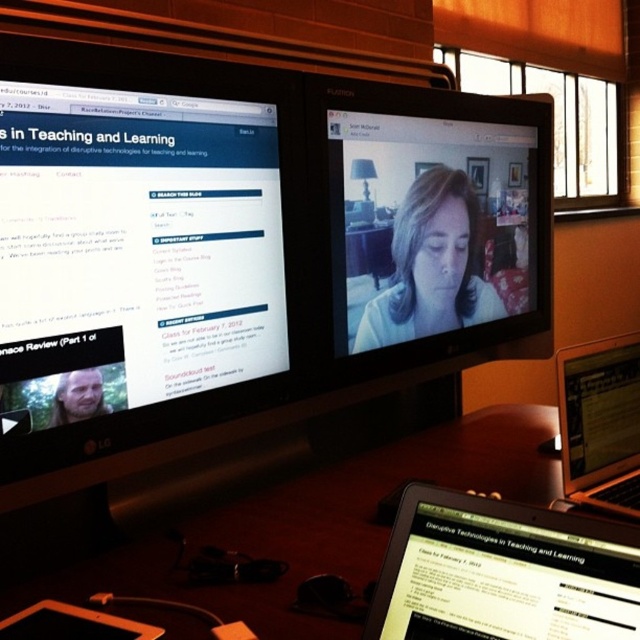
Does wooden desk at center appear on the right side of matte black tablet at lower right?

No, wooden desk at center is not to the right of matte black tablet at lower right.

Identify the location of wooden desk at center. (320, 522).

I want to click on wooden desk at center, so click(x=320, y=522).

Locate an element on the screen. The width and height of the screenshot is (640, 640). wooden desk at center is located at coordinates (320, 522).

In the scene shown: Can you confirm if matte black tablet at lower right is shorter than matte white face at center?

Yes, matte black tablet at lower right is shorter than matte white face at center.

Does point (630, 536) come farther from viewer compared to point (442, 204)?

No, (630, 536) is in front of (442, 204).

Where is `matte black tablet at lower right`? This screenshot has height=640, width=640. matte black tablet at lower right is located at coordinates (502, 572).

Does black glossy monitor at upper center appear on the left side of black glossy laptop at lower right?

Correct, you'll find black glossy monitor at upper center to the left of black glossy laptop at lower right.

Who is more distant from viewer, (67, 232) or (557, 381)?

Positioned behind is point (557, 381).

In order to click on black glossy monitor at upper center in this screenshot , I will do `click(244, 250)`.